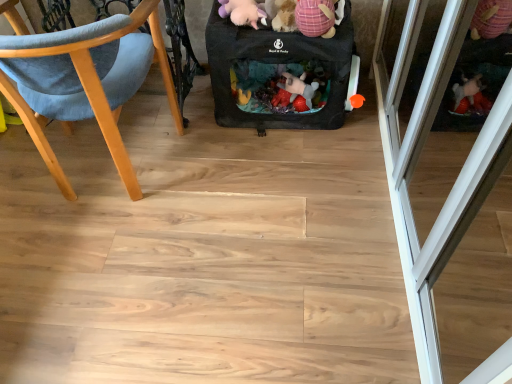
The height and width of the screenshot is (384, 512). Find the location of `vacant space underneath transparent glass screen door at right (from a real-world perspective)`. vacant space underneath transparent glass screen door at right (from a real-world perspective) is located at coordinates (464, 241).